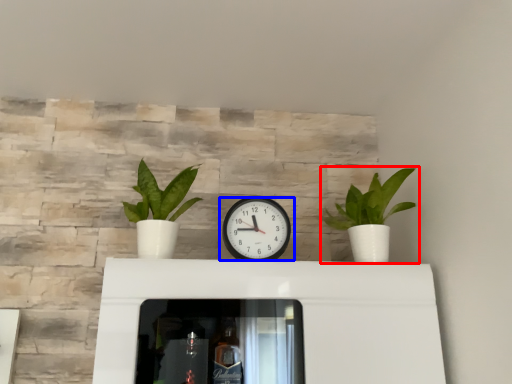
Question: Which point is further to the camera, houseplant (highlighted by a red box) or wall clock (highlighted by a blue box)?

Choices:
 (A) houseplant
 (B) wall clock

Answer: (B)